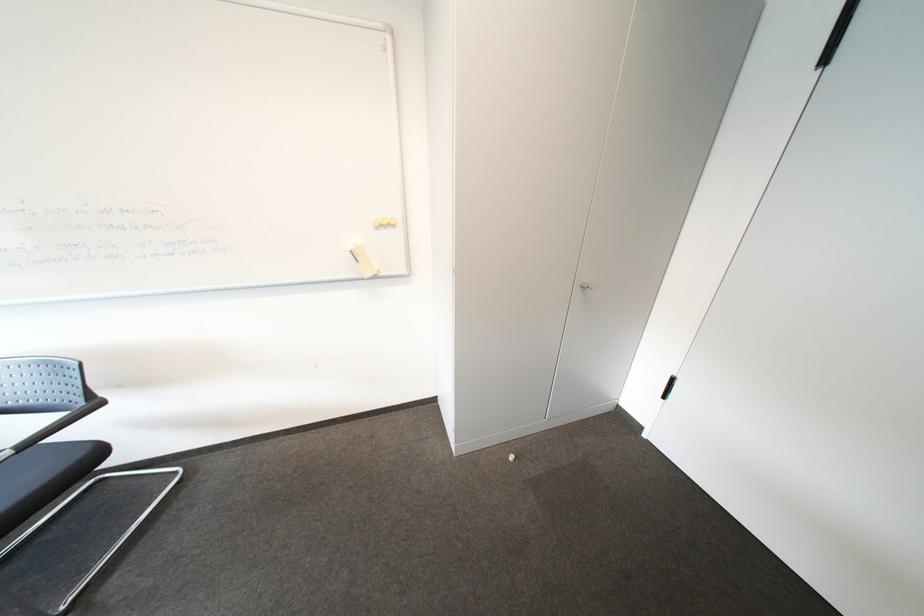
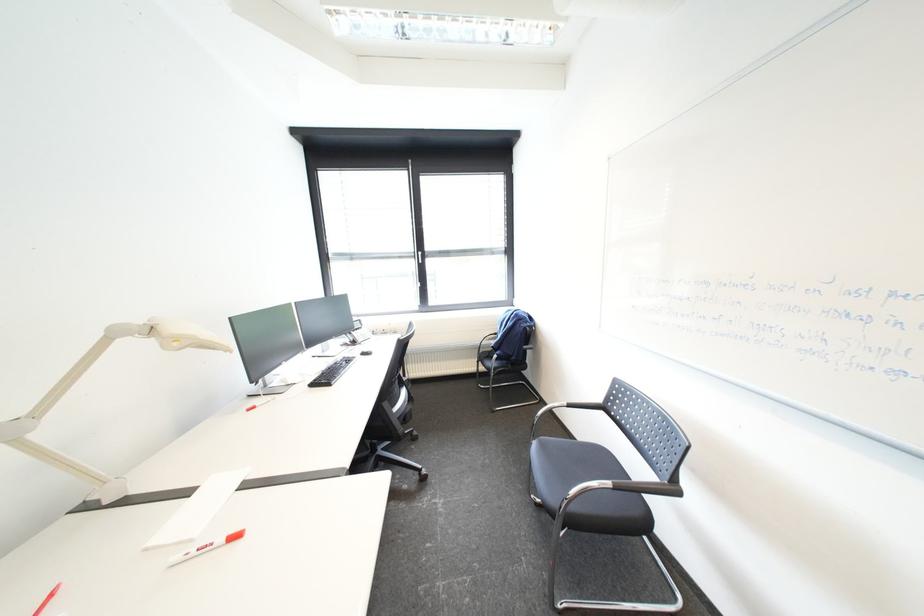
Question: Based on the continuous images, in which direction is the camera rotating? Reply with the corresponding letter.

Choices:
 (A) Left
 (B) Right
 (C) Up
 (D) Down

Answer: (A)